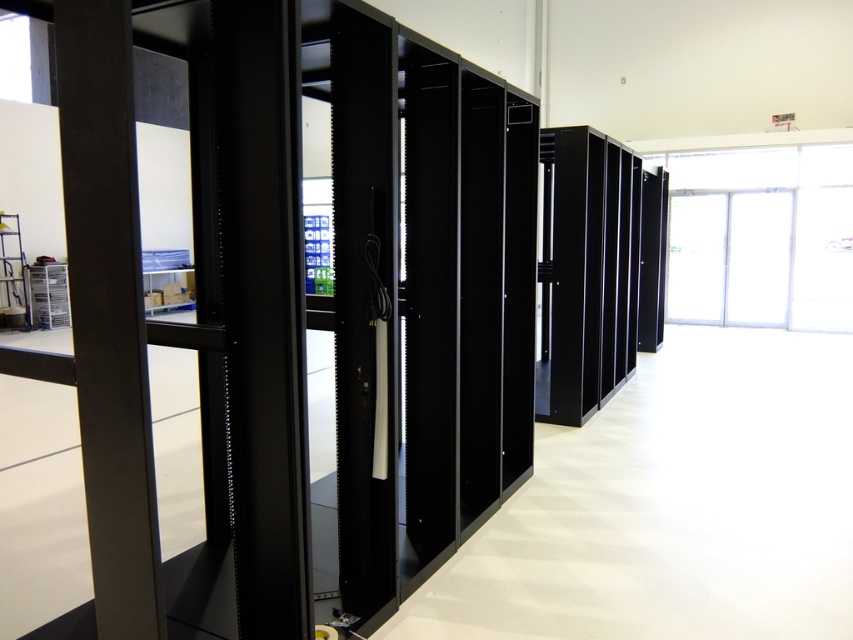
Consider the image. Which is above, matte black pillar at left or black matte server rack at center?

black matte server rack at center

Is the position of matte black pillar at left less distant than that of black matte server rack at center?

Yes, it is.

You are a GUI agent. You are given a task and a screenshot of the screen. Output one action in this format:
    pyautogui.click(x=<x>, y=<y>)
    Task: Click on the matte black pillar at left
    Image resolution: width=853 pixels, height=640 pixels.
    Given the screenshot: What is the action you would take?
    pyautogui.click(x=108, y=312)